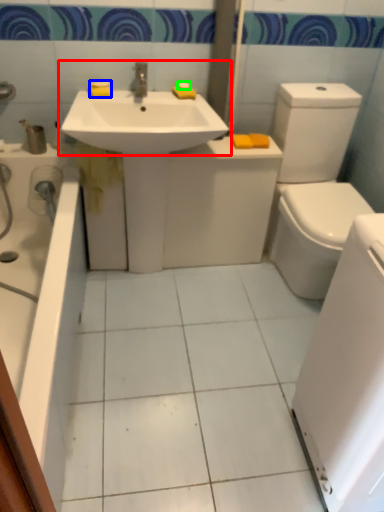
Question: Estimate the real-world distances between objects in this image. Which object is farther from sink (highlighted by a red box), soap (highlighted by a blue box) or soap (highlighted by a green box)?

Choices:
 (A) soap
 (B) soap

Answer: (B)